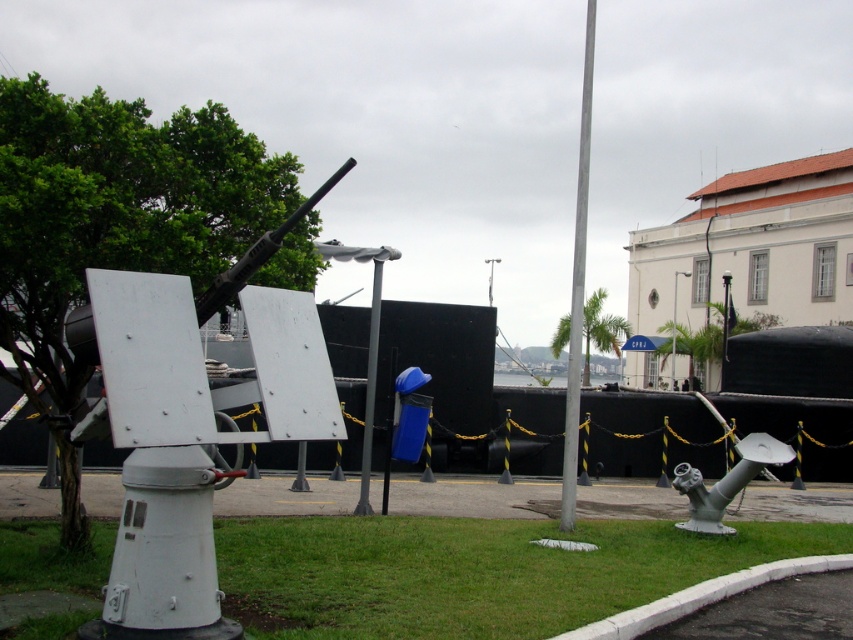
Question: Can you confirm if silver metallic pole at center is thinner than silver metallic cannon at lower right?

Choices:
 (A) yes
 (B) no

Answer: (B)

Question: Based on their relative distances, which object is nearer to the silver metallic cannon at lower right?

Choices:
 (A) white matte cannon at center
 (B) green grass at lower center
 (C) metallic pole at center

Answer: (C)

Question: Considering the real-world distances, which object is farthest from the white matte cannon at center?

Choices:
 (A) green grass at lower center
 (B) silver metallic pole at center
 (C) metallic pole at center

Answer: (B)

Question: In this image, where is green grass at lower center located relative to silver metallic pole at center?

Choices:
 (A) right
 (B) left

Answer: (B)

Question: Can you confirm if silver metallic pole at center is positioned to the left of silver metallic cannon at lower right?

Choices:
 (A) no
 (B) yes

Answer: (A)

Question: Which of the following is the farthest from the observer?

Choices:
 (A) pyautogui.click(x=312, y=561)
 (B) pyautogui.click(x=376, y=307)

Answer: (B)